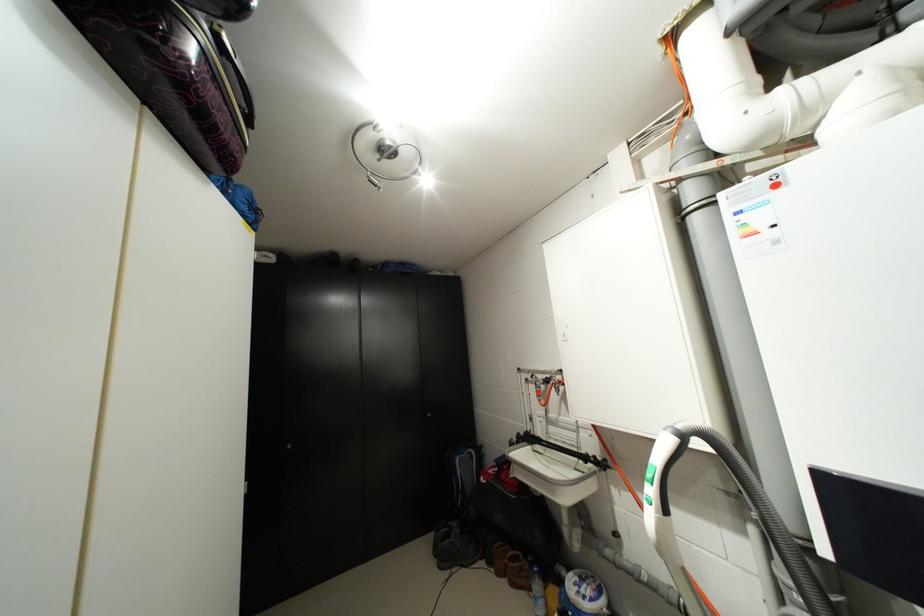
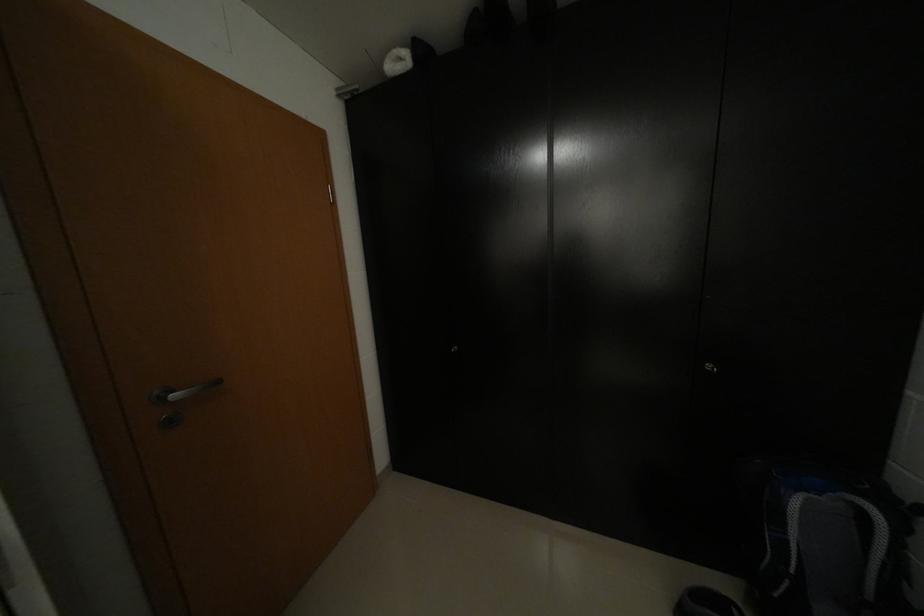
Locate, in the second image, the point that corresponds to [272,262] in the first image.

(407, 70)